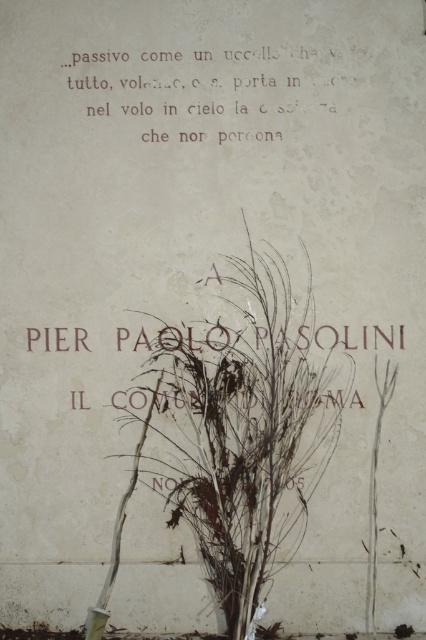
You are an art student analyzing the composition of this memorial site. You notice the brown dried plant at center and the matte white text at upper center. Which object is located to the right of the other?

The brown dried plant at center is positioned on the right side of matte white text at upper center.